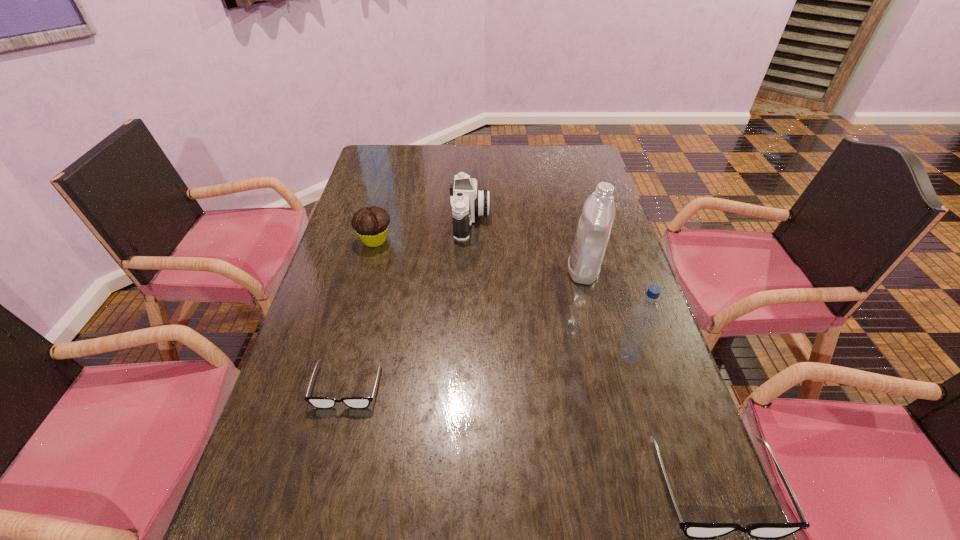
Identify the location of the left spectacles. (318, 402).

The width and height of the screenshot is (960, 540). In order to click on the shorter spectacles in this screenshot , I will do `click(318, 402)`.

The width and height of the screenshot is (960, 540). In order to click on the third shortest object in this screenshot , I will do `click(371, 224)`.

Identify the location of the tallest object. The height and width of the screenshot is (540, 960). (592, 235).

The width and height of the screenshot is (960, 540). I want to click on detergent, so click(x=592, y=235).

Identify the location of camera. The width and height of the screenshot is (960, 540). (467, 202).

The height and width of the screenshot is (540, 960). Identify the location of the third tallest object. (467, 202).

Locate an element on the screen. The image size is (960, 540). the second tallest object is located at coordinates (644, 317).

Find the location of a particular element. The image size is (960, 540). vacant space located 0.090m on the front-facing side of the shorter spectacles is located at coordinates (331, 450).

The width and height of the screenshot is (960, 540). Find the location of `vacant area situated on the front of the muffin`. vacant area situated on the front of the muffin is located at coordinates (355, 313).